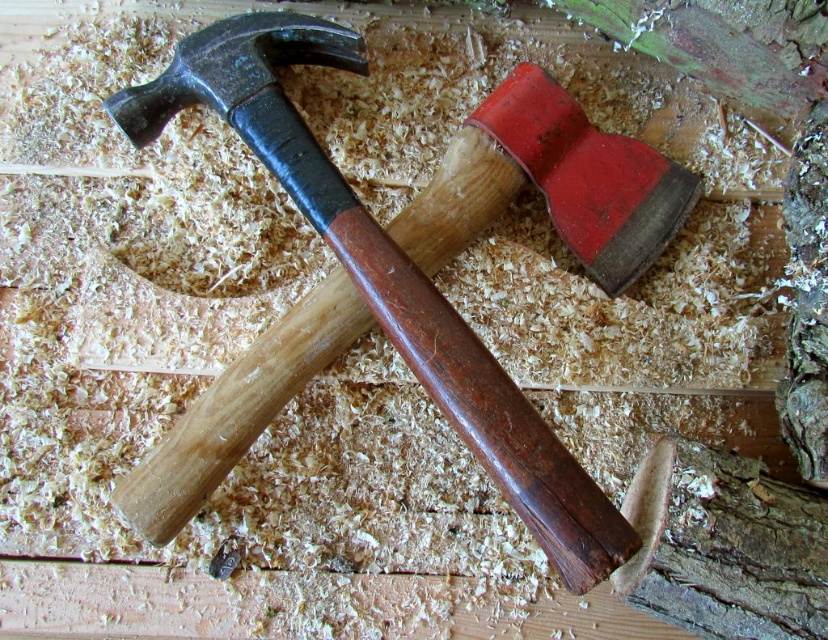
Question: Is matte black hammer at upper left thinner than smooth bark tree trunk at lower right?

Choices:
 (A) yes
 (B) no

Answer: (B)

Question: Is matte black hammer at upper left smaller than smooth bark tree trunk at lower right?

Choices:
 (A) yes
 (B) no

Answer: (B)

Question: Is matte black hammer at upper left bigger than smooth bark tree trunk at lower right?

Choices:
 (A) yes
 (B) no

Answer: (A)